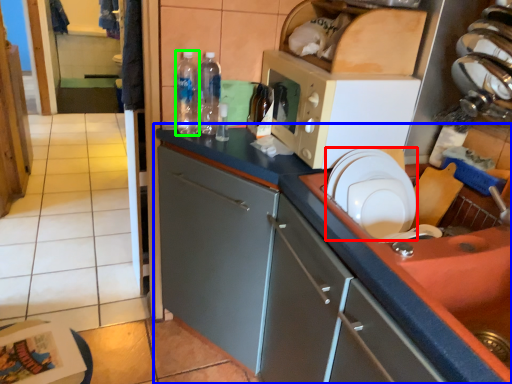
Question: Considering the real-world distances, which object is farthest from paper plate (highlighted by a red box)? cabinetry (highlighted by a blue box) or bottle (highlighted by a green box)?

Choices:
 (A) cabinetry
 (B) bottle

Answer: (B)